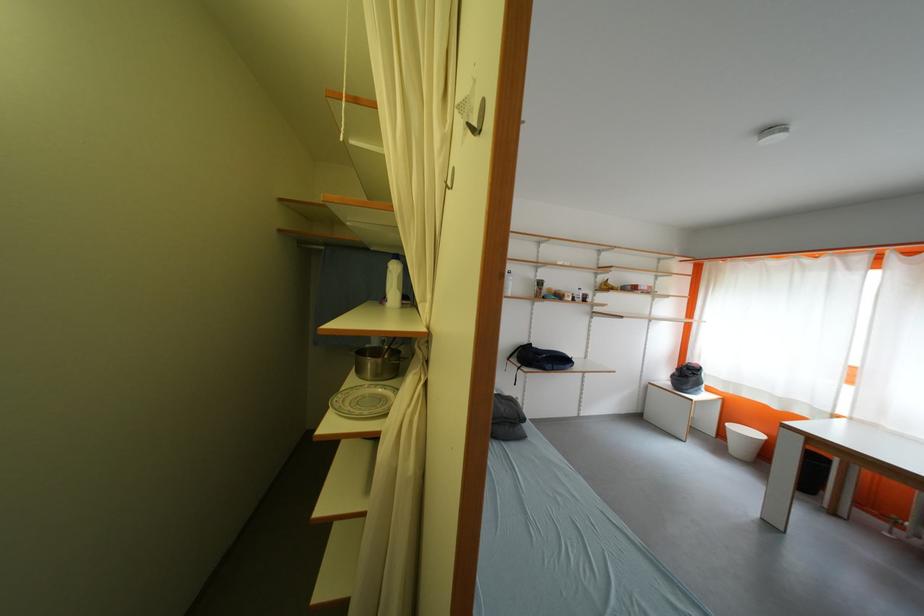
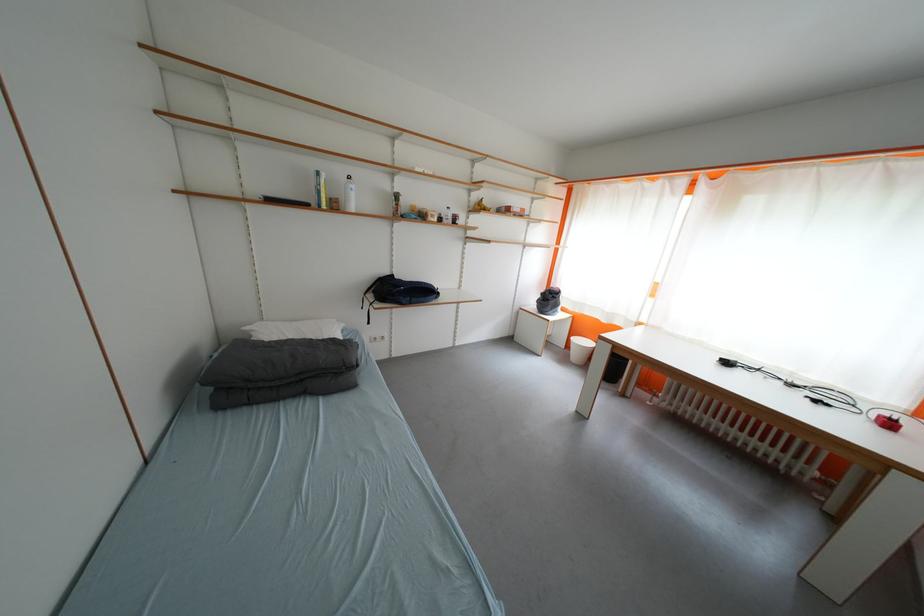
The point at (724, 447) is marked in the first image. Where is the corresponding point in the second image?

(572, 358)